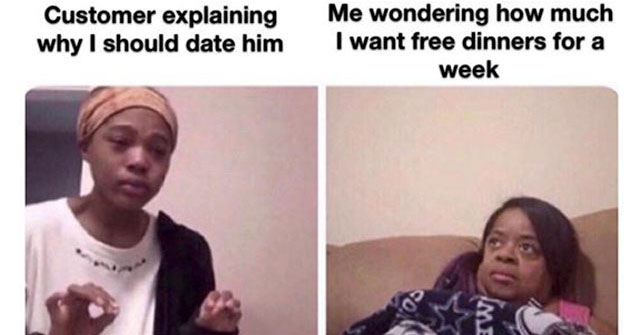
This screenshot has height=335, width=640. I want to click on couch, so click(x=370, y=276).